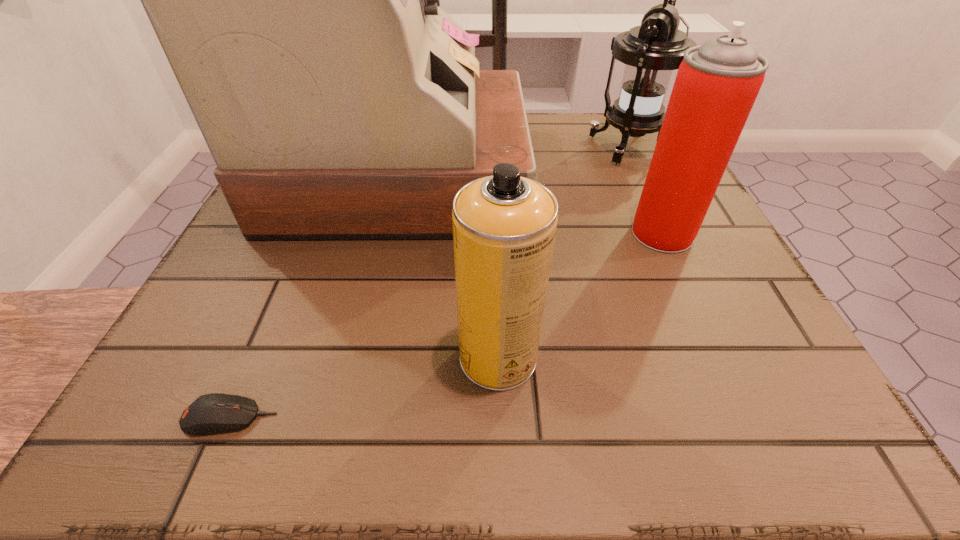
Where is `free area in between the second nearest object and the computer mouse`? free area in between the second nearest object and the computer mouse is located at coordinates (364, 388).

Where is `blank region between the right aerosol can and the shorter aerosol can`? blank region between the right aerosol can and the shorter aerosol can is located at coordinates pos(580,295).

What are the coordinates of `vacant space that's between the tallest object and the computer mouse` in the screenshot? It's located at (316, 296).

Identify the location of vacant region between the left aerosol can and the cash register. (449, 266).

Find the location of `empty space between the nearest object and the tallest object`. empty space between the nearest object and the tallest object is located at coordinates (316, 296).

Find the location of a particular element. This screenshot has width=960, height=540. the closest object to the shortest object is located at coordinates (504, 226).

I want to click on the closest object to the second nearest object, so click(x=297, y=0).

Identify the location of free spot that satisfies the following two spatial constraints: 1. on the operating side of the tallest object; 2. on the back side of the farther aerosol can. The image size is (960, 540). (387, 233).

Find the location of a particular element. The width and height of the screenshot is (960, 540). free spot that satisfies the following two spatial constraints: 1. on the front side of the lantern; 2. on the operating side of the tallest object is located at coordinates (641, 174).

The image size is (960, 540). Identify the location of vacant space that satisfies the following two spatial constraints: 1. on the operating side of the tallest object; 2. on the right side of the left aerosol can. (358, 357).